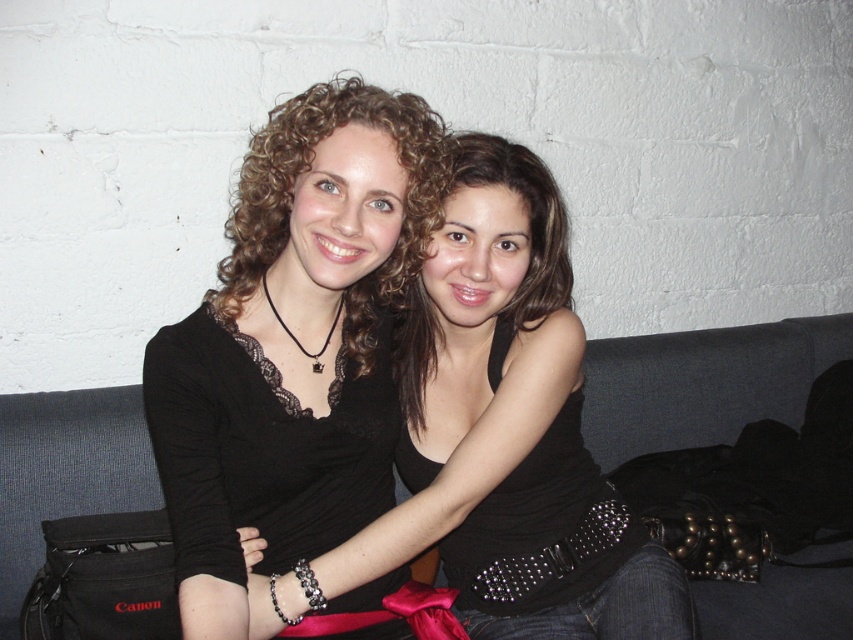
Question: Which point is farther to the camera?

Choices:
 (A) (376, 570)
 (B) (460, 184)
 (C) (525, 602)

Answer: (C)

Question: Among these points, which one is farthest from the camera?

Choices:
 (A) (218, 468)
 (B) (405, 252)
 (C) (495, 154)
 (D) (598, 540)

Answer: (D)

Question: Can you confirm if black lace top at center is smaller than dark gray fabric couch at center?

Choices:
 (A) yes
 (B) no

Answer: (B)

Question: Is black lace top at center positioned behind matte black top at center?

Choices:
 (A) yes
 (B) no

Answer: (A)

Question: Does dark gray fabric couch at center appear under black studded belt at center?

Choices:
 (A) no
 (B) yes

Answer: (A)

Question: Which point is farther from the camera taking this photo?

Choices:
 (A) pos(517,262)
 (B) pos(543,241)

Answer: (B)